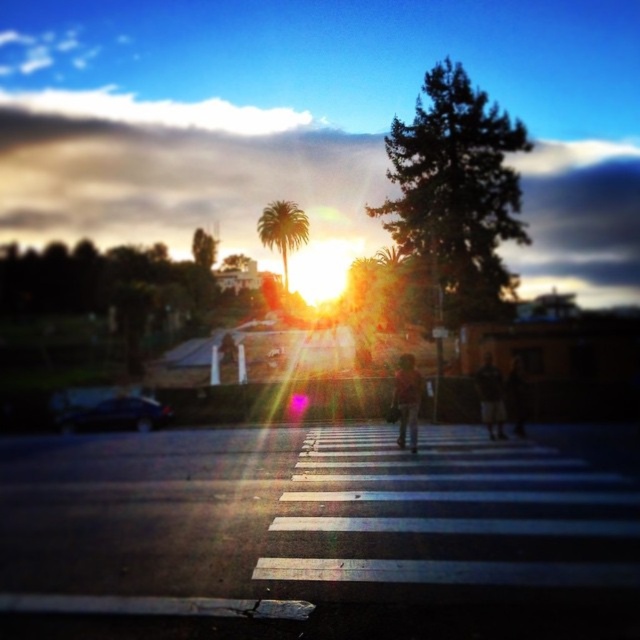
Can you confirm if green leafy palm tree at center is smaller than orange fabric bag at center?

No.

Does green leafy palm tree at center lie in front of orange fabric bag at center?

No, it is not.

Does point (285, 221) lie behind point (404, 365)?

Yes, point (285, 221) is behind point (404, 365).

Identify the location of green leafy palm tree at center. The image size is (640, 640). (282, 228).

Is the position of green leafy palm tree at center less distant than that of dark brown leather jacket at center?

No, it is not.

Does green leafy palm tree at center have a greater height compared to dark brown leather jacket at center?

Correct, green leafy palm tree at center is much taller as dark brown leather jacket at center.

Who is more forward, (280, 216) or (509, 387)?

Point (509, 387) is in front.

This screenshot has height=640, width=640. I want to click on green leafy palm tree at center, so click(282, 228).

Can you confirm if orange fabric bag at center is thinner than camouflage fabric jacket at center?

Incorrect, orange fabric bag at center's width is not less than camouflage fabric jacket at center's.

Which of these two, orange fabric bag at center or camouflage fabric jacket at center, stands shorter?

With less height is camouflage fabric jacket at center.

This screenshot has width=640, height=640. I want to click on orange fabric bag at center, so click(406, 400).